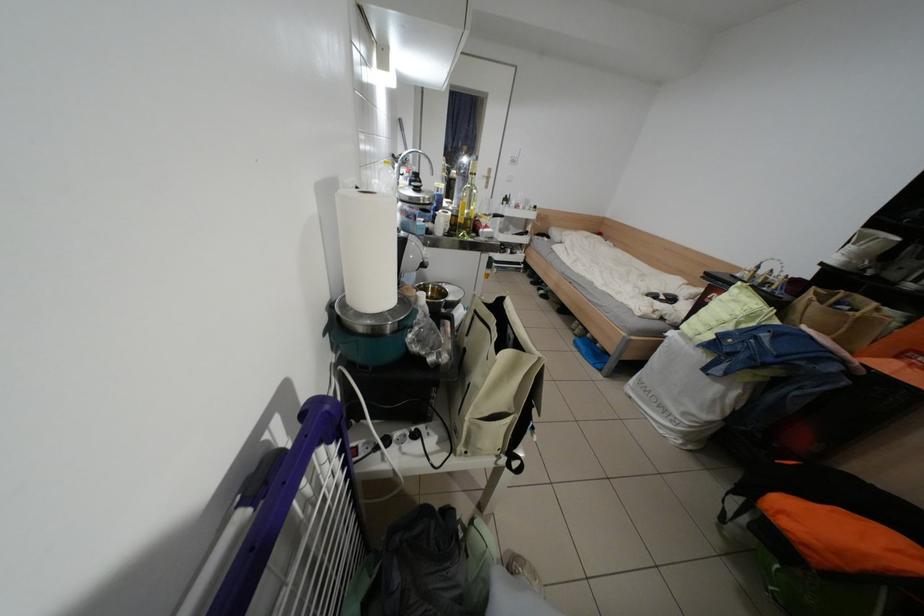
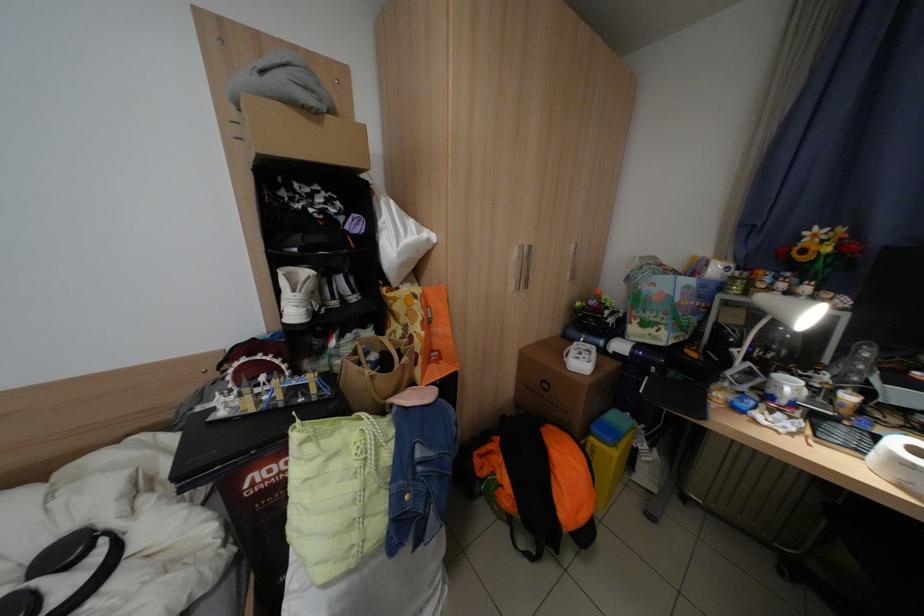
Find the pixel in the second image that matches [747,302] in the first image.

(342, 460)